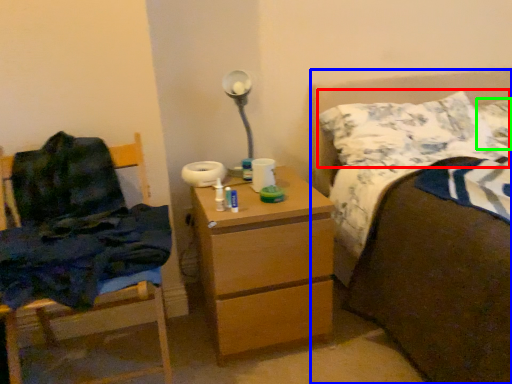
Question: Estimate the real-world distances between objects in this image. Which object is closer to pillow (highlighted by a red box), bed (highlighted by a blue box) or pillow (highlighted by a green box)?

Choices:
 (A) bed
 (B) pillow

Answer: (B)